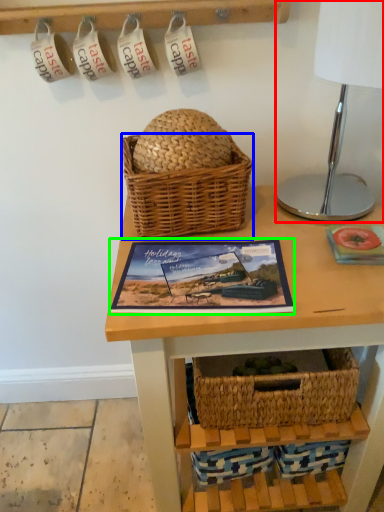
Question: Estimate the real-world distances between objects in this image. Which object is closer to table lamp (highlighted by a red box), picnic basket (highlighted by a blue box) or picture frame (highlighted by a green box)?

Choices:
 (A) picnic basket
 (B) picture frame

Answer: (A)